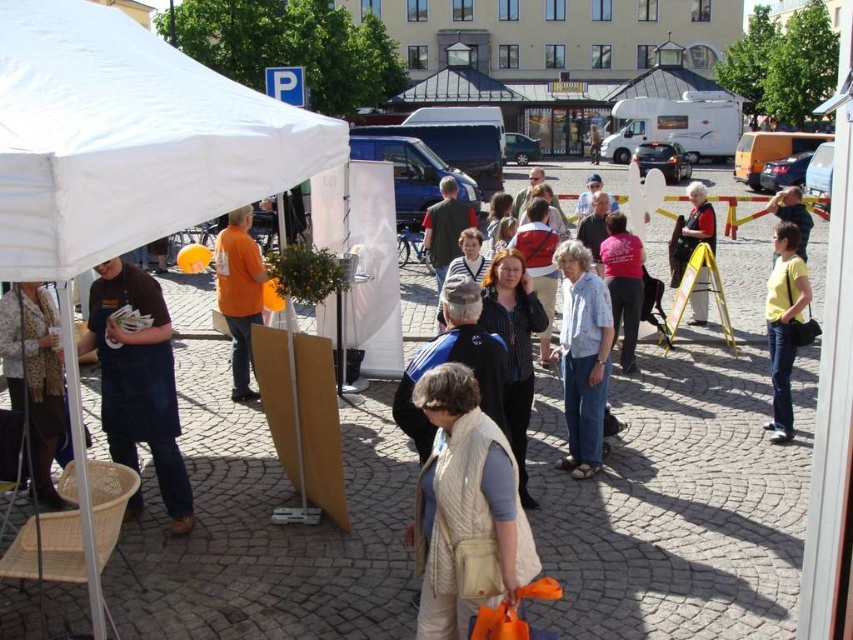
Question: Which of these objects is positioned closest to the pink fabric shirt at center?

Choices:
 (A) brown apron at left
 (B) white fabric canopy at upper left

Answer: (B)

Question: Based on their relative distances, which object is nearer to the beige quilted vest at center?

Choices:
 (A) pink fabric shirt at center
 (B) blue cotton shirt at center

Answer: (B)

Question: Among these points, which one is nearest to the camera?

Choices:
 (A) (19, 410)
 (B) (598, 456)
 (C) (199, 212)
 (D) (422, 609)

Answer: (C)

Question: Is yellow cotton shirt at right positioned at the back of pink fabric shirt at center?

Choices:
 (A) yes
 (B) no

Answer: (B)

Question: Does white fabric tent at left have a smaller size compared to leopard print scarf at lower left?

Choices:
 (A) yes
 (B) no

Answer: (B)

Question: Observing the image, what is the correct spatial positioning of blue cotton shirt at center in reference to matte black jacket at center?

Choices:
 (A) above
 (B) below

Answer: (B)